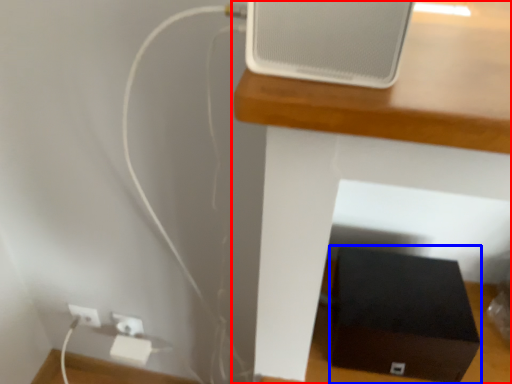
Question: Which of the following is the closest to the observer, furniture (highlighted by a red box) or box (highlighted by a blue box)?

Choices:
 (A) furniture
 (B) box

Answer: (A)